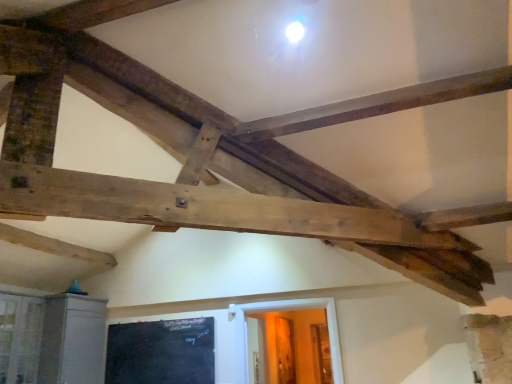
Question: Is white wooden door at lower center bigger than clear glass window at lower left?

Choices:
 (A) yes
 (B) no

Answer: (B)

Question: Does white wooden door at lower center come behind clear glass window at lower left?

Choices:
 (A) no
 (B) yes

Answer: (B)

Question: Considering the relative sizes of white wooden door at lower center and clear glass window at lower left in the image provided, is white wooden door at lower center smaller than clear glass window at lower left?

Choices:
 (A) yes
 (B) no

Answer: (A)

Question: Is white wooden door at lower center at the left side of clear glass window at lower left?

Choices:
 (A) no
 (B) yes

Answer: (A)

Question: From a real-world perspective, is white wooden door at lower center positioned over clear glass window at lower left based on gravity?

Choices:
 (A) yes
 (B) no

Answer: (B)

Question: Is white wooden door at lower center not within clear glass window at lower left?

Choices:
 (A) no
 (B) yes

Answer: (B)

Question: Is black chalkboard at lower left to the left of clear glass window at lower left from the viewer's perspective?

Choices:
 (A) yes
 (B) no

Answer: (B)

Question: Is black chalkboard at lower left at the right side of clear glass window at lower left?

Choices:
 (A) no
 (B) yes

Answer: (B)

Question: Does black chalkboard at lower left come behind clear glass window at lower left?

Choices:
 (A) no
 (B) yes

Answer: (B)

Question: Is black chalkboard at lower left facing towards clear glass window at lower left?

Choices:
 (A) yes
 (B) no

Answer: (A)

Question: Is black chalkboard at lower left positioned beyond the bounds of clear glass window at lower left?

Choices:
 (A) yes
 (B) no

Answer: (A)

Question: From a real-world perspective, is black chalkboard at lower left located beneath clear glass window at lower left?

Choices:
 (A) yes
 (B) no

Answer: (A)

Question: From the image's perspective, is clear glass window at lower left beneath black chalkboard at lower left?

Choices:
 (A) yes
 (B) no

Answer: (B)